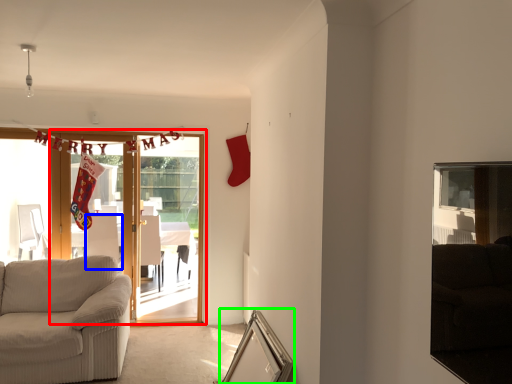
Question: Estimate the real-world distances between objects in this image. Which object is farther from door (highlighted by a red box), armchair (highlighted by a blue box) or picture frame (highlighted by a green box)?

Choices:
 (A) armchair
 (B) picture frame

Answer: (A)